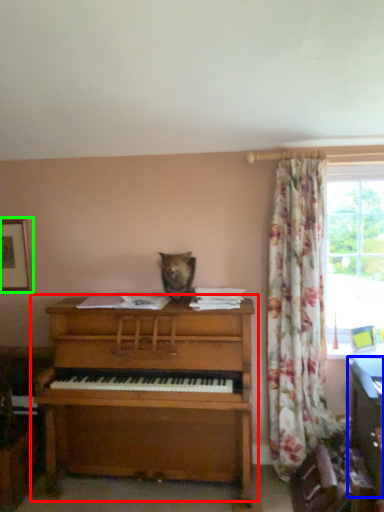
Question: Considering the real-world distances, which object is farthest from piano (highlighted by a red box)? computer desk (highlighted by a blue box) or picture frame (highlighted by a green box)?

Choices:
 (A) computer desk
 (B) picture frame

Answer: (A)